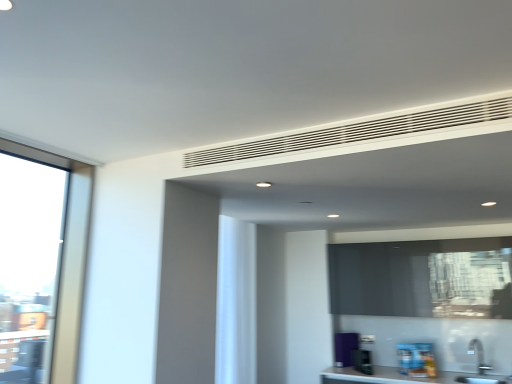
Question: Is white matte curtain at center to the left or to the right of blue glossy book at lower right, which is the 1th appliance from right to left, in the image?

Choices:
 (A) right
 (B) left

Answer: (B)

Question: Is white matte curtain at center in front of or behind blue glossy book at lower right, the 3th appliance viewed from the left, in the image?

Choices:
 (A) behind
 (B) front

Answer: (B)

Question: Considering the real-world distances, which object is farthest from the green plastic toaster at lower center, the second appliance in the right-to-left sequence?

Choices:
 (A) purple matte refrigerator at lower right, which is counted as the 1th appliance, starting from the back
 (B) white matte curtain at center
 (C) blue glossy book at lower right, which is the first appliance from front to back
 (D) black matte window screen at center
 (E) white matte vent at upper center

Answer: (E)

Question: Which of these objects is positioned closest to the purple matte refrigerator at lower right, which is the first appliance from left to right?

Choices:
 (A) blue glossy book at lower right, which is the 1th appliance from right to left
 (B) green plastic toaster at lower center, the second appliance in the right-to-left sequence
 (C) white matte vent at upper center
 (D) black matte window screen at center
 (E) white matte curtain at center

Answer: (B)